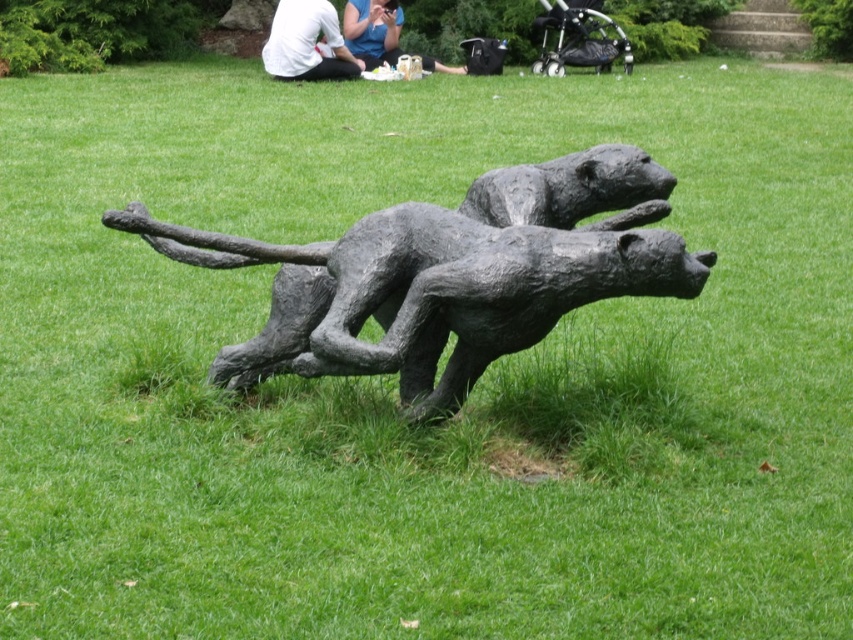
You are a photographer standing in front of the bronze textured sculpture at center and the white cotton shirt at upper center. You want to take a photo that includes both objects. Which object should you position closer to the camera to ensure both are in focus?

To ensure both the bronze textured sculpture at center and the white cotton shirt at upper center are in focus, position the white cotton shirt at upper center closer to the camera since it is smaller than the sculpture. This adjustment helps balance their sizes in the frame, making both appear appropriately scaled and in focus.

You are a photographer trying to capture the bronze textured sculpture at center without any distractions. Since the white shirt at upper center is in the frame, can you adjust your position to the left to eliminate it?

The bronze textured sculpture at center is positioned on the right side of the white shirt at upper center. Moving to the left might still show the white shirt at upper center because it is to the right of the sculpture, so shifting left could keep both in frame or shift the shirt out depending on the angle. However, since the shirt is at upper center, moving left might not fully remove it. A better approach might be to move to the right side of the sculpture to block the shirt with your body or adjust the